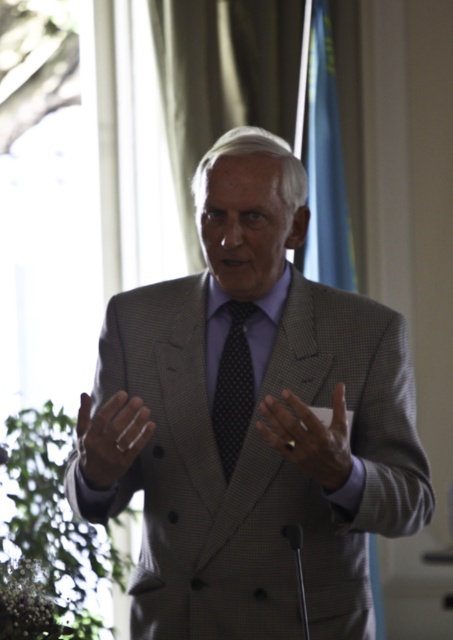
Question: Is gray textured suit at center to the left of black dotted tie at center from the viewer's perspective?

Choices:
 (A) no
 (B) yes

Answer: (A)

Question: Can you confirm if gray textured suit at center is positioned below smooth gray suit at center?

Choices:
 (A) no
 (B) yes

Answer: (A)

Question: Considering the relative positions of smooth gray suit at center and black dotted tie at center in the image provided, where is smooth gray suit at center located with respect to black dotted tie at center?

Choices:
 (A) right
 (B) left

Answer: (A)

Question: Among these objects, which one is nearest to the camera?

Choices:
 (A) gray textured suit at center
 (B) smooth gray suit at center

Answer: (B)

Question: Which object is positioned farthest from the black dotted tie at center?

Choices:
 (A) gray textured suit at center
 (B) clear plastic ring at center
 (C) smooth gray suit at center

Answer: (B)

Question: Based on their relative distances, which object is farther from the smooth gray suit at center?

Choices:
 (A) gray textured suit at center
 (B) clear plastic ring at center

Answer: (B)